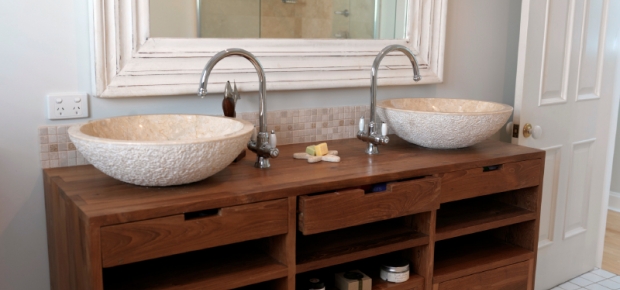
Image resolution: width=620 pixels, height=290 pixels. Find the location of `small white jar`. small white jar is located at coordinates (401, 275).